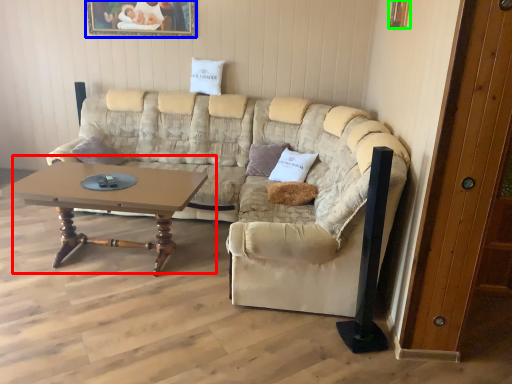
Question: Which object is the closest to the coffee table (highlighted by a red box)? Choose among these: picture frame (highlighted by a blue box) or picture frame (highlighted by a green box).

Choices:
 (A) picture frame
 (B) picture frame

Answer: (A)